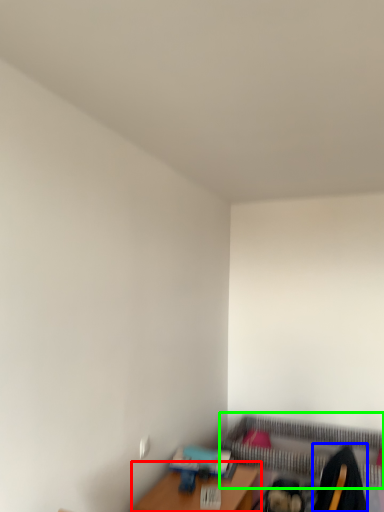
Question: Based on their relative distances, which object is nearer to table (highlighted by a red box)? Choose from swivel chair (highlighted by a blue box) and bed frame (highlighted by a green box).

Choices:
 (A) swivel chair
 (B) bed frame

Answer: (A)